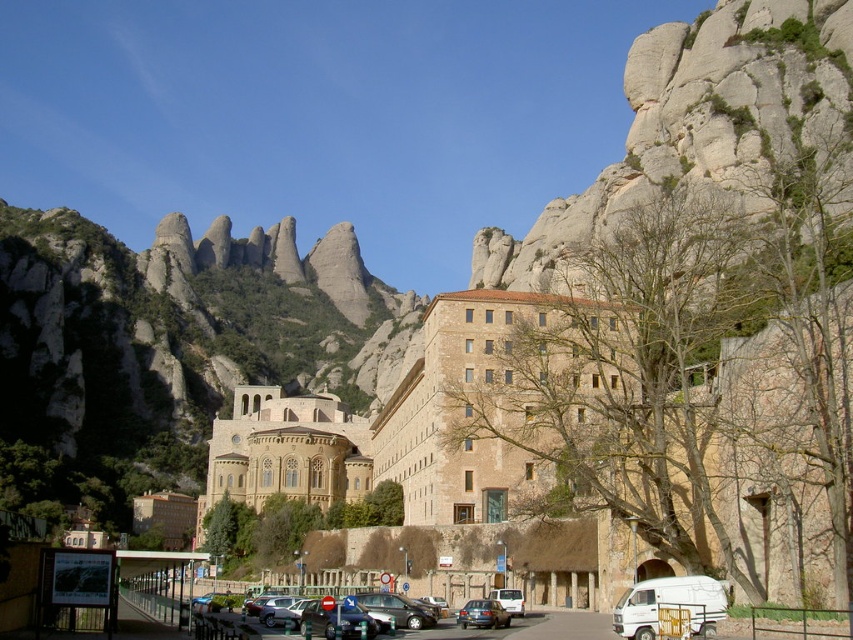
Question: Is white matte camper van at lower right above matte black car at center?

Choices:
 (A) no
 (B) yes

Answer: (B)

Question: Can you confirm if brown stone building at center is wider than white matte camper van at lower right?

Choices:
 (A) no
 (B) yes

Answer: (B)

Question: Is brown stone building at center to the right of matte black sedan at center from the viewer's perspective?

Choices:
 (A) yes
 (B) no

Answer: (B)

Question: Which of these objects is positioned farthest from the white matte camper van at lower right?

Choices:
 (A) matte black car at center
 (B) brown stone building at center

Answer: (B)

Question: Which of the following is the farthest from the observer?

Choices:
 (A) (253, 506)
 (B) (473, 625)
 (C) (635, 612)
 (D) (368, 593)

Answer: (A)

Question: Which point appears farthest from the camera in this image?

Choices:
 (A) (454, 616)
 (B) (329, 426)
 (C) (462, 611)
 (D) (669, 589)

Answer: (B)